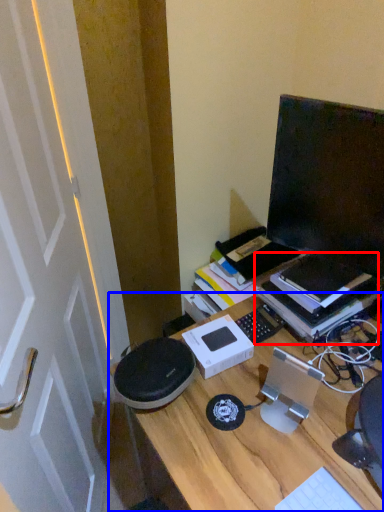
Question: Which object appears closest to the camera in this image, book (highlighted by a red box) or desk (highlighted by a blue box)?

Choices:
 (A) book
 (B) desk

Answer: (B)